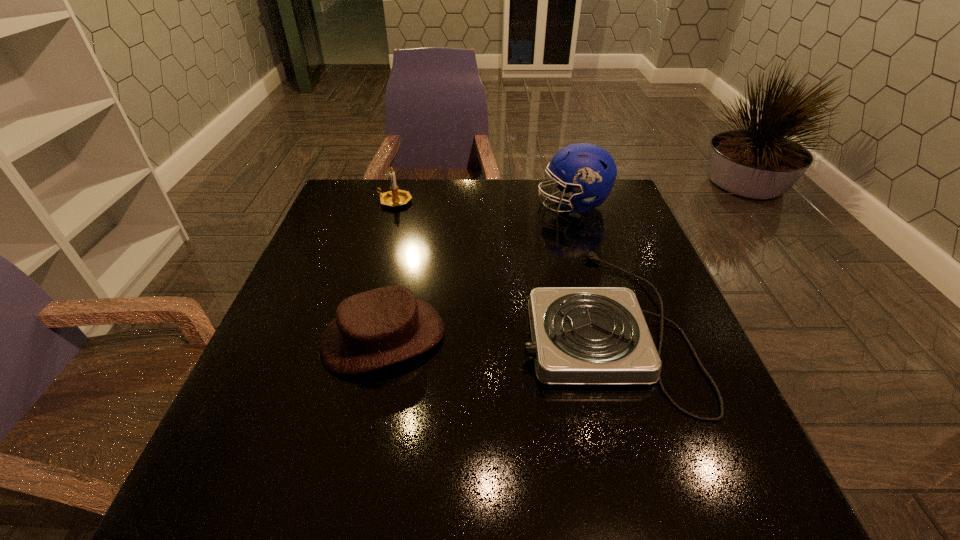
The image size is (960, 540). What are the coordinates of `football helmet` in the screenshot? It's located at (590, 171).

At what (x,y) coordinates should I click in order to perform the action: click on candle holder. Please return your answer as a coordinate pair (x, y). Looking at the image, I should click on (395, 197).

The height and width of the screenshot is (540, 960). In order to click on hat in this screenshot , I will do [380, 327].

Where is `the shortest object`? the shortest object is located at coordinates (580, 335).

Locate an element on the screen. The height and width of the screenshot is (540, 960). blank space located on the front-facing side of the football helmet is located at coordinates (486, 204).

Identify the location of vacant position located on the front-facing side of the football helmet. Image resolution: width=960 pixels, height=540 pixels. point(510,204).

This screenshot has height=540, width=960. Find the location of `vacant region located 0.270m on the front-facing side of the football helmet`. vacant region located 0.270m on the front-facing side of the football helmet is located at coordinates (444, 204).

Locate an element on the screen. The width and height of the screenshot is (960, 540). free space located on the front of the candle holder is located at coordinates (386, 233).

Find the location of a particular element. Image resolution: width=960 pixels, height=540 pixels. free space located on the back of the second shortest object is located at coordinates (403, 246).

The image size is (960, 540). Identify the location of free space located with a retractable cable on the side of the hotplate. (369, 324).